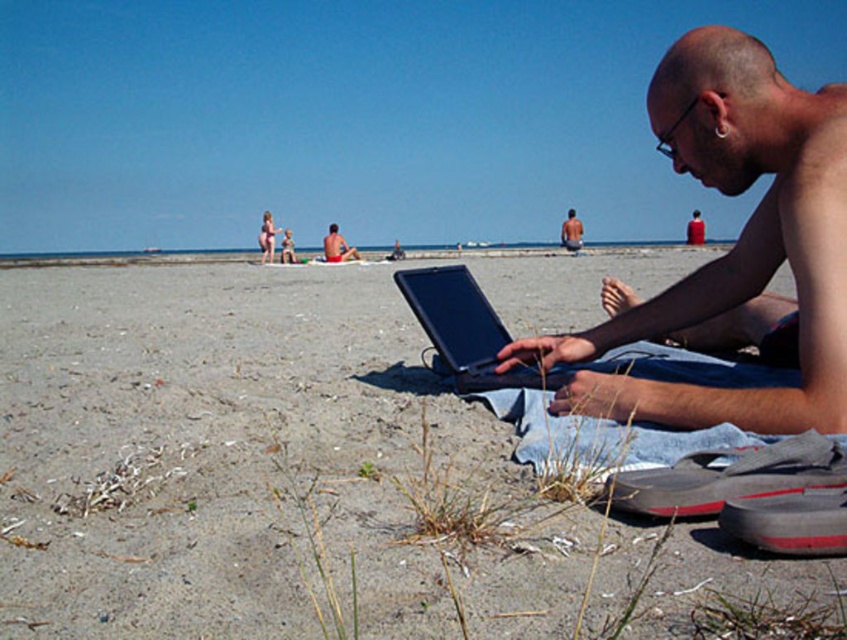
You are a drone operator trying to locate a specific point on the beach. The point is labeled as point (216, 449). Based on the scene, where is this point located?

The point (216, 449) is located on the gray sand at lower center.

You are standing at the beach and want to reach a specific point marked at coordinates point (325, 253). If you can walk 1.5 meters per second, how many seconds will it take you to reach that point?

The distance of point (325, 253) from viewer is 14.46 meters. At a walking speed of 1.5 meters per second, it will take approximately 9.64 seconds to reach the point.

In the scene shown: You are a photographer trying to capture the shiny black laptop at lower right and the gray sand at lower center in the same frame. Which object will appear larger in the photo?

The shiny black laptop at lower right will appear larger in the photo because it is taller than the gray sand at lower center.